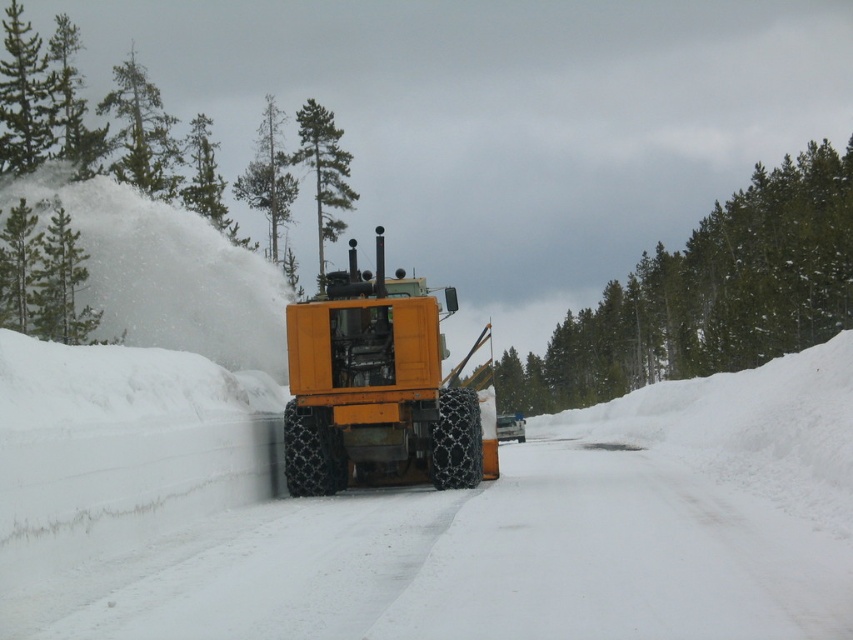
Is yellow rubber snowplow at center shorter than orange rubber tractor at center?

Yes, yellow rubber snowplow at center is shorter than orange rubber tractor at center.

Image resolution: width=853 pixels, height=640 pixels. What do you see at coordinates (459, 528) in the screenshot?
I see `yellow rubber snowplow at center` at bounding box center [459, 528].

Is point (598, 588) positioned behind point (305, 364)?

No.

I want to click on yellow rubber snowplow at center, so click(x=459, y=528).